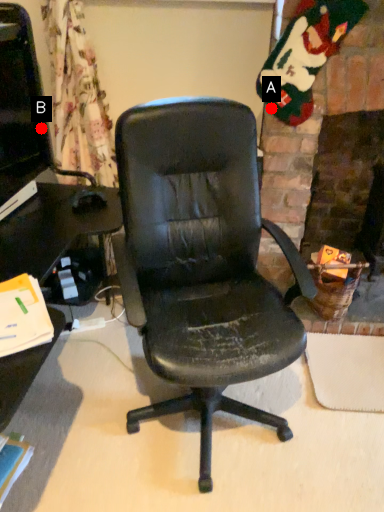
Question: Two points are circled on the image, labeled by A and B beside each circle. Among these points, which one is farthest from the camera?

Choices:
 (A) A is further
 (B) B is further

Answer: (B)